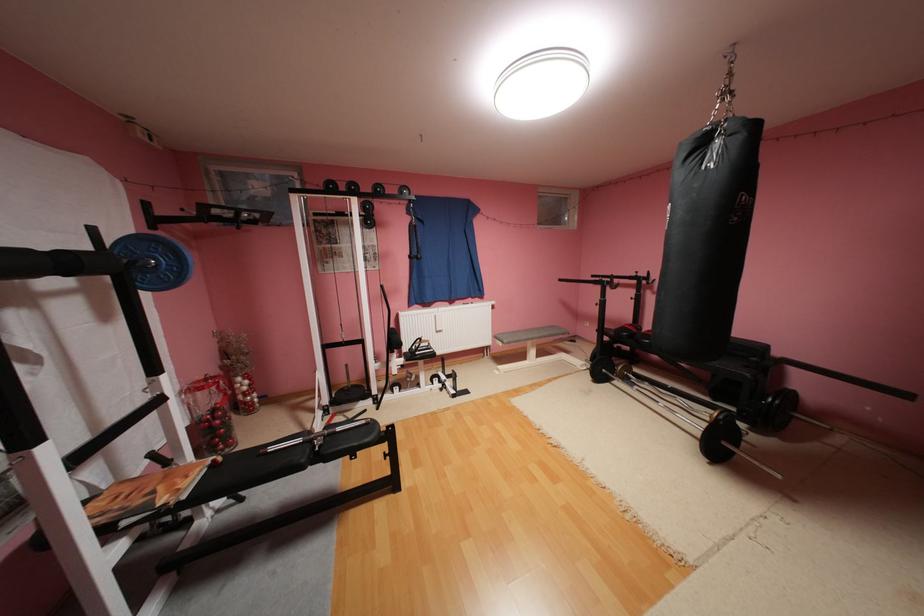
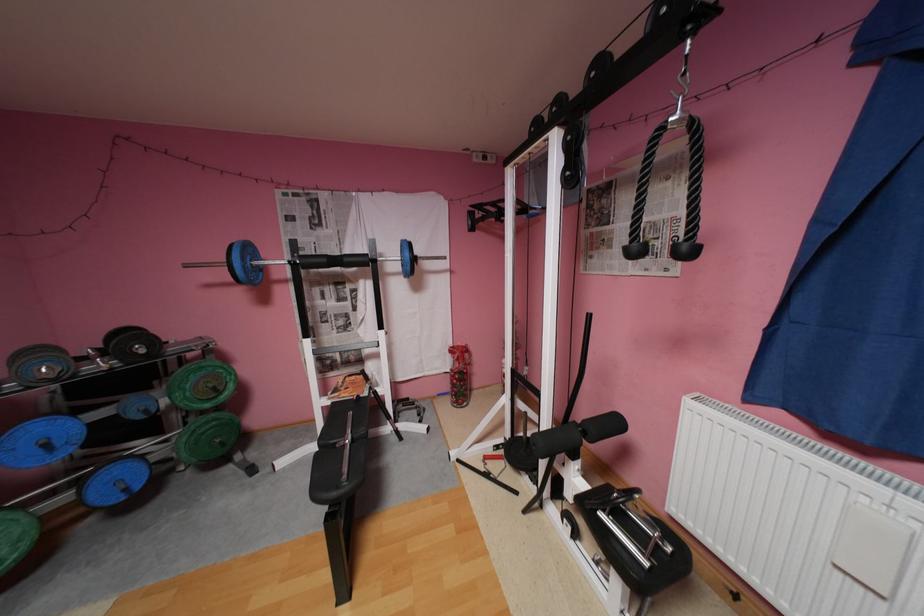
Locate, in the second image, the point that corresponds to the point at 126,569 in the first image.

(333, 408)